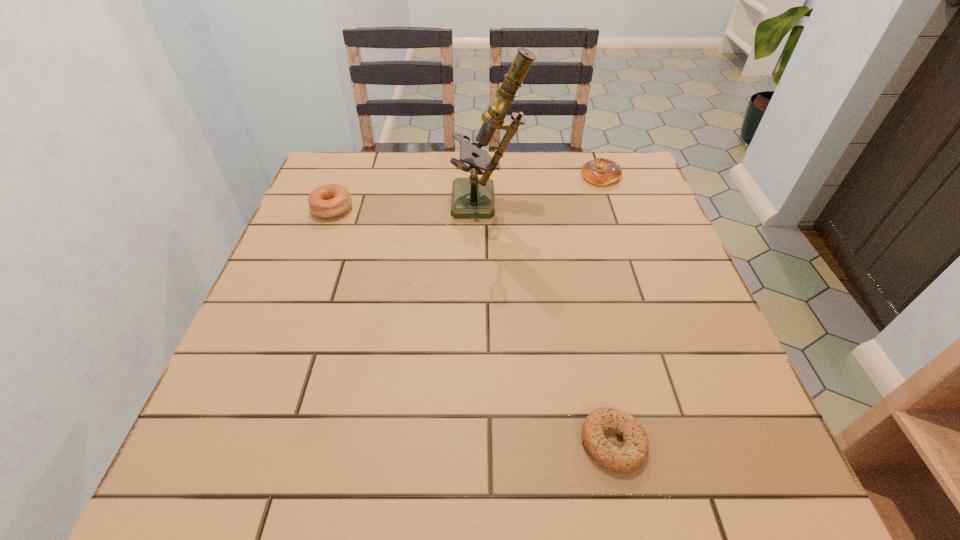
Identify the location of the third object from right to left. The height and width of the screenshot is (540, 960). (471, 197).

The image size is (960, 540). I want to click on the tallest object, so click(471, 197).

You are a GUI agent. You are given a task and a screenshot of the screen. Output one action in this format:
    pyautogui.click(x=<x>, y=<y>)
    Task: Click on the leftmost object
    Image resolution: width=960 pixels, height=540 pixels.
    Given the screenshot: What is the action you would take?
    pyautogui.click(x=327, y=201)

Find the location of a particular element. the leftmost bagel is located at coordinates (327, 201).

Locate an element on the screen. The image size is (960, 540). the farthest bagel is located at coordinates (602, 171).

In order to click on the rightmost object in this screenshot , I will do `click(602, 171)`.

This screenshot has width=960, height=540. In order to click on the nearest bagel in this screenshot , I will do `click(632, 454)`.

Locate an element on the screen. This screenshot has width=960, height=540. the nearest object is located at coordinates (632, 454).

This screenshot has height=540, width=960. What are the coordinates of `blank space located at the eyepiece of the tallest object` in the screenshot? It's located at (376, 204).

Where is `vacant space located at the eyepiece of the tallest object`? Image resolution: width=960 pixels, height=540 pixels. vacant space located at the eyepiece of the tallest object is located at coordinates (349, 204).